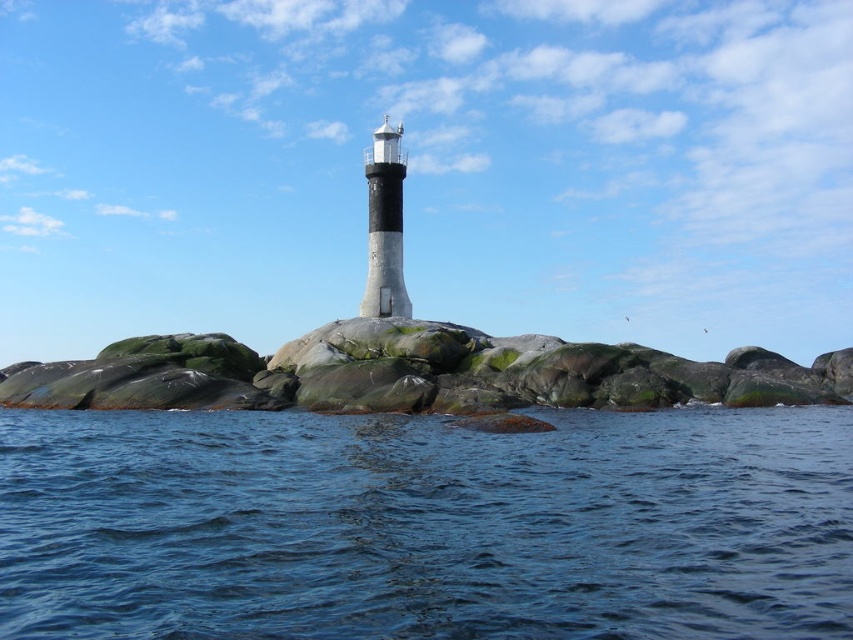
You are a bird flying over the lighthouse and want to land on the blue water at center. Based on the coordinates provided, can you confirm if the point marked by point [426,525] is indeed over the blue water at center?

Yes, the point [426,525] marks blue water at center, so it is indeed over the blue water at center.

You are a photographer planning to capture the blue water at center and the green mossy rock at center in a single frame. Based on the scene, which object would appear smaller in the photograph?

The blue water at center appears smaller in the photograph compared to the green mossy rock at center because the description states that the blue water at center has a smaller size compared to green mossy rock at center.

You are a photographer positioned at the base of the lighthouse. You want to capture a photo where both the blue water at center and the green mossy rock at center are clearly visible. Which object should you focus on first to ensure both are in sharp focus?

You should focus on the green mossy rock at center first because it is farther away from the viewer than the blue water at center. By focusing on the farther object, the closer object will also be in focus due to the depth of field.